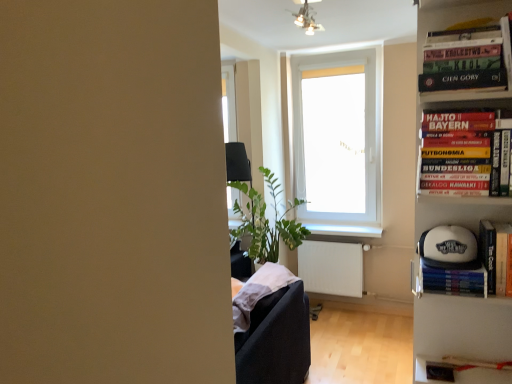
Question: From a real-world perspective, is white glossy window sill at center positioned above or below white plastic window at center?

Choices:
 (A) above
 (B) below

Answer: (B)

Question: Choose the correct answer: Is white glossy window sill at center inside white plastic window at center or outside it?

Choices:
 (A) outside
 (B) inside

Answer: (A)

Question: Considering the real-world distances, which object is closest to the white plastic bookcase at right?

Choices:
 (A) hardcover book at right, the 2th book in the top-to-bottom sequence
 (B) white plastic window at center
 (C) white matte baseball cap at right
 (D) white matte baseball cap at right, the 1th book from the bottom
 (E) white glossy window sill at center

Answer: (C)

Question: Estimate the real-world distances between objects in this image. Which object is closer to the white matte baseball cap at right?

Choices:
 (A) hardcover book at upper right, which appears as the first book when viewed from the top
 (B) hardcover book at right, the 2th book in the top-to-bottom sequence
 (C) white plastic bookcase at right
 (D) white plastic window at center
 (E) white glossy window sill at center

Answer: (C)